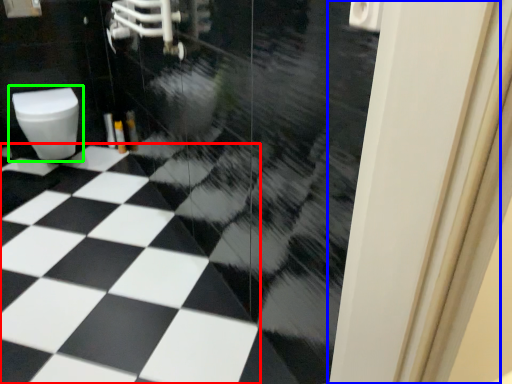
Question: Based on their relative distances, which object is farther from tile (highlighted by a red box)? Choose from screen door (highlighted by a blue box) and toilet (highlighted by a green box).

Choices:
 (A) screen door
 (B) toilet

Answer: (A)